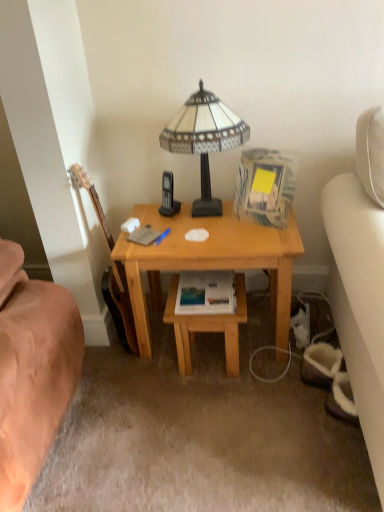
Question: Does matte paper paperback book at center appear on the left side of stained glass lampshade at center?

Choices:
 (A) yes
 (B) no

Answer: (B)

Question: Is matte paper paperback book at center not within stained glass lampshade at center?

Choices:
 (A) no
 (B) yes

Answer: (B)

Question: Does matte paper paperback book at center have a lesser width compared to stained glass lampshade at center?

Choices:
 (A) no
 (B) yes

Answer: (B)

Question: Considering the relative sizes of matte paper paperback book at center and stained glass lampshade at center in the image provided, is matte paper paperback book at center bigger than stained glass lampshade at center?

Choices:
 (A) no
 (B) yes

Answer: (A)

Question: Are matte paper paperback book at center and stained glass lampshade at center located far from each other?

Choices:
 (A) no
 (B) yes

Answer: (A)

Question: Based on their positions, is matte paper paperback book at center located to the left or right of light brown wood table at center?

Choices:
 (A) right
 (B) left

Answer: (B)

Question: Looking at the image, does matte paper paperback book at center seem bigger or smaller compared to light brown wood table at center?

Choices:
 (A) small
 (B) big

Answer: (A)

Question: From a real-world perspective, is matte paper paperback book at center physically located above or below light brown wood table at center?

Choices:
 (A) below
 (B) above

Answer: (B)

Question: Considering the positions of matte paper paperback book at center and light brown wood table at center in the image, is matte paper paperback book at center taller or shorter than light brown wood table at center?

Choices:
 (A) tall
 (B) short

Answer: (B)

Question: In terms of height, does light brown wood table at center look taller or shorter compared to wooden desk at center?

Choices:
 (A) short
 (B) tall

Answer: (A)

Question: Based on their sizes in the image, would you say light brown wood table at center is bigger or smaller than wooden desk at center?

Choices:
 (A) big
 (B) small

Answer: (B)

Question: From the image's perspective, is light brown wood table at center located above or below wooden desk at center?

Choices:
 (A) above
 (B) below

Answer: (B)

Question: From a real-world perspective, relative to wooden desk at center, is light brown wood table at center vertically above or below?

Choices:
 (A) above
 (B) below

Answer: (B)

Question: Looking at their shapes, would you say wooden acoustic guitar at left is wider or thinner than wooden desk at center?

Choices:
 (A) thin
 (B) wide

Answer: (A)

Question: Considering the positions of wooden acoustic guitar at left and wooden desk at center in the image, is wooden acoustic guitar at left taller or shorter than wooden desk at center?

Choices:
 (A) short
 (B) tall

Answer: (B)